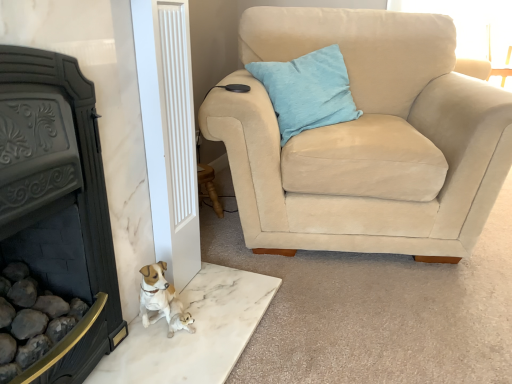
The image size is (512, 384). What do you see at coordinates (365, 139) in the screenshot? I see `beige suede armchair at upper right` at bounding box center [365, 139].

Identify the location of light blue fabric pillow at upper right. (307, 91).

The height and width of the screenshot is (384, 512). I want to click on black cast iron fireplace at left, so click(58, 202).

Is light blue fabric pillow at upper right to the left or to the right of beige suede armchair at upper right in the image?

light blue fabric pillow at upper right is positioned on beige suede armchair at upper right's left side.

Considering the sizes of objects light blue fabric pillow at upper right and beige suede armchair at upper right in the image provided, who is smaller, light blue fabric pillow at upper right or beige suede armchair at upper right?

light blue fabric pillow at upper right is smaller.

How different are the orientations of light blue fabric pillow at upper right and beige suede armchair at upper right in degrees?

34.6 degrees.

Locate an element on the screen. This screenshot has height=384, width=512. pillow on the left of the beige suede armchair at upper right is located at coordinates (307, 91).

From the image's perspective, does beige suede armchair at upper right appear higher than light blue fabric pillow at upper right?

Incorrect, from the image's perspective, beige suede armchair at upper right is lower than light blue fabric pillow at upper right.

Between beige suede armchair at upper right and light blue fabric pillow at upper right, which one has smaller width?

light blue fabric pillow at upper right is thinner.

Considering the relative positions of beige suede armchair at upper right and light blue fabric pillow at upper right in the image provided, is beige suede armchair at upper right to the left of light blue fabric pillow at upper right from the viewer's perspective?

No.

Who is shorter, black cast iron fireplace at left or beige suede armchair at upper right?

With less height is black cast iron fireplace at left.

Is the surface of black cast iron fireplace at left in direct contact with beige suede armchair at upper right?

No, black cast iron fireplace at left is not with beige suede armchair at upper right.

Considering the sizes of objects black cast iron fireplace at left and beige suede armchair at upper right in the image provided, who is wider, black cast iron fireplace at left or beige suede armchair at upper right?

Wider between the two is beige suede armchair at upper right.

Locate an element on the screen. pillow behind the black cast iron fireplace at left is located at coordinates (307, 91).

Is light blue fabric pillow at upper right thinner than black cast iron fireplace at left?

Incorrect, the width of light blue fabric pillow at upper right is not less than that of black cast iron fireplace at left.

Is light blue fabric pillow at upper right positioned with its back to black cast iron fireplace at left?

No, light blue fabric pillow at upper right is not facing the opposite direction of black cast iron fireplace at left.

Is light blue fabric pillow at upper right at the left side of black cast iron fireplace at left?

In fact, light blue fabric pillow at upper right is to the right of black cast iron fireplace at left.

Is point (16, 60) positioned before point (274, 103)?

Yes, point (16, 60) is closer to viewer.

Between black cast iron fireplace at left and light blue fabric pillow at upper right, which one has larger size?

black cast iron fireplace at left.

Can we say black cast iron fireplace at left lies outside light blue fabric pillow at upper right?

Yes, black cast iron fireplace at left is located beyond the bounds of light blue fabric pillow at upper right.

Based on the photo, is black cast iron fireplace at left taller than light blue fabric pillow at upper right?

Yes.

Consider the image. From a real-world perspective, is beige suede armchair at upper right on top of black cast iron fireplace at left?

Yes.

Which object is more forward, beige suede armchair at upper right or black cast iron fireplace at left?

black cast iron fireplace at left is closer to the camera.

Considering the relative positions of beige suede armchair at upper right and black cast iron fireplace at left in the image provided, is beige suede armchair at upper right to the left of black cast iron fireplace at left from the viewer's perspective?

No.

This screenshot has height=384, width=512. Identify the location of pillow behind the beige suede armchair at upper right. (307, 91).

Identify the location of chair on the right of light blue fabric pillow at upper right. This screenshot has width=512, height=384. (365, 139).

Estimate the real-world distances between objects in this image. Which object is further from black cast iron fireplace at left, light blue fabric pillow at upper right or beige suede armchair at upper right?

light blue fabric pillow at upper right is positioned further to the anchor black cast iron fireplace at left.

Looking at the image, which one is located further to black cast iron fireplace at left, beige suede armchair at upper right or light blue fabric pillow at upper right?

light blue fabric pillow at upper right.

Estimate the real-world distances between objects in this image. Which object is further from light blue fabric pillow at upper right, beige suede armchair at upper right or black cast iron fireplace at left?

The object further to light blue fabric pillow at upper right is black cast iron fireplace at left.

Based on their spatial positions, is light blue fabric pillow at upper right or black cast iron fireplace at left further from beige suede armchair at upper right?

The object further to beige suede armchair at upper right is black cast iron fireplace at left.

Considering their positions, is black cast iron fireplace at left positioned further to beige suede armchair at upper right than light blue fabric pillow at upper right?

The object further to beige suede armchair at upper right is black cast iron fireplace at left.

In the scene shown: Looking at the image, which one is located closer to light blue fabric pillow at upper right, black cast iron fireplace at left or beige suede armchair at upper right?

beige suede armchair at upper right lies closer to light blue fabric pillow at upper right than the other object.

The width and height of the screenshot is (512, 384). What are the coordinates of `chair located between black cast iron fireplace at left and light blue fabric pillow at upper right in the depth direction` in the screenshot? It's located at (365, 139).